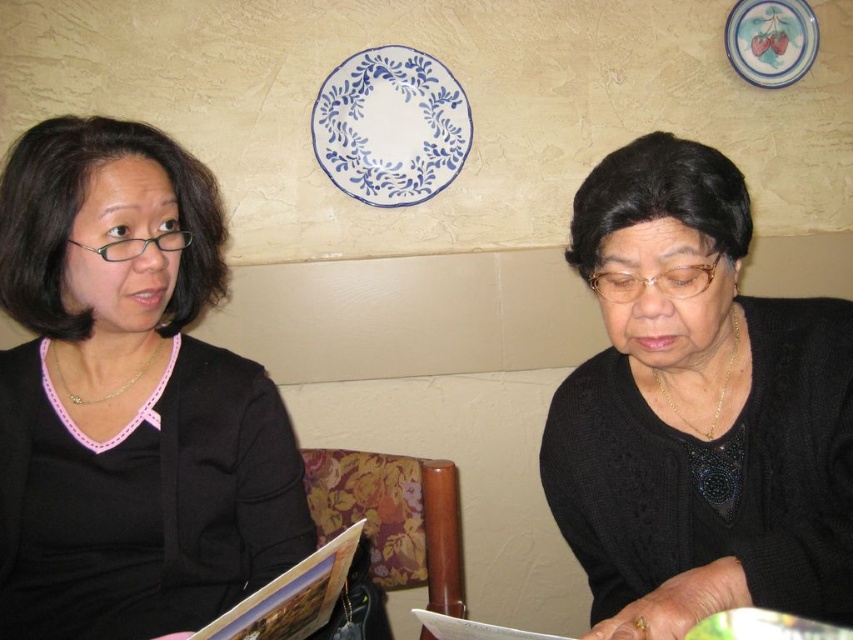
You are designing a clothing catalog and need to place the black matte sweater at upper left and the black matte sweater at lower right next to each other. Based on the image, which sweater should be placed on the left side to maintain proper alignment?

The black matte sweater at upper left should be placed on the left side since it is wider than the black matte sweater at lower right, ensuring a balanced layout.

You are a photographer standing at a distance. You want to take a closeup photo of the black matte sweater at upper left. The camera you are using has a minimum focusing distance of 30 inches. Can you take the photo without moving closer?

The distance between the black matte sweater at upper left and the camera is 35.42 inches, which is greater than the camera minimum focusing distance of 30 inches. Therefore, you can take the photo without moving closer.

You are standing in a casual setting like a restaurant or a cafe. You see two points marked in the image. Which point is closer to you, point (59, 413) or point (750, 305)?

Point (59, 413) is closer to you than point (750, 305).